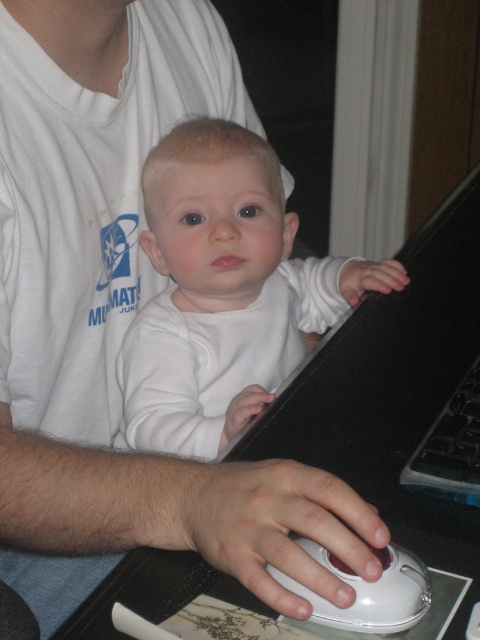
Question: Does white matte baby at center lie behind black plastic keyboard at lower right?

Choices:
 (A) no
 (B) yes

Answer: (B)

Question: Is white matte baby at center bigger than black plastic keyboard at lower right?

Choices:
 (A) yes
 (B) no

Answer: (A)

Question: Among these objects, which one is farthest from the camera?

Choices:
 (A) white matte baby at center
 (B) white plastic mouse at lower center

Answer: (A)

Question: Does white plastic mouse at lower center come in front of black plastic keyboard at lower right?

Choices:
 (A) yes
 (B) no

Answer: (A)

Question: Which of the following is the farthest from the observer?

Choices:
 (A) (428, 577)
 (B) (447, 451)
 (C) (206, 132)

Answer: (C)

Question: Considering the real-world distances, which object is closest to the white plastic mouse at lower center?

Choices:
 (A) black plastic keyboard at lower right
 (B) white matte baby at center

Answer: (A)